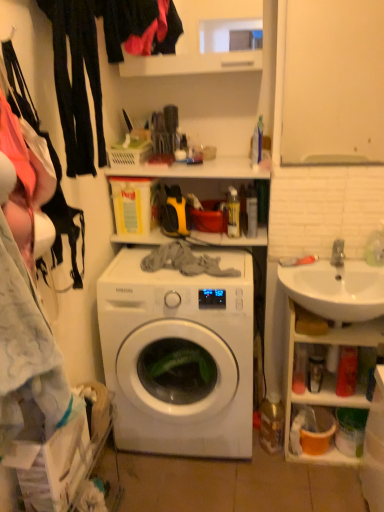
Locate an element on the screen. free space to the left of white glossy sink at lower right is located at coordinates (268, 471).